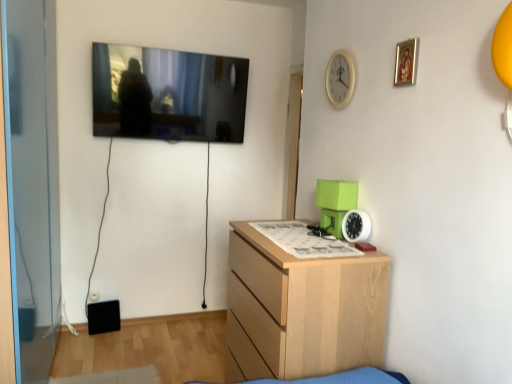
Question: Could gold-framed picture at upper right be considered to be inside flat screen tv at upper left?

Choices:
 (A) yes
 (B) no

Answer: (B)

Question: Considering the relative sizes of flat screen tv at upper left and gold-framed picture at upper right in the image provided, is flat screen tv at upper left thinner than gold-framed picture at upper right?

Choices:
 (A) yes
 (B) no

Answer: (B)

Question: Is flat screen tv at upper left outside of gold-framed picture at upper right?

Choices:
 (A) yes
 (B) no

Answer: (A)

Question: Are flat screen tv at upper left and gold-framed picture at upper right making contact?

Choices:
 (A) no
 (B) yes

Answer: (A)

Question: Does flat screen tv at upper left lie in front of gold-framed picture at upper right?

Choices:
 (A) yes
 (B) no

Answer: (B)

Question: From the image's perspective, is flat screen tv at upper left located above gold-framed picture at upper right?

Choices:
 (A) no
 (B) yes

Answer: (B)

Question: Is white plastic clock at right, the 1th clock from the bottom, positioned far away from flat screen tv at upper left?

Choices:
 (A) no
 (B) yes

Answer: (B)

Question: Is white plastic clock at right, the 1th clock from the bottom, aimed at flat screen tv at upper left?

Choices:
 (A) no
 (B) yes

Answer: (A)

Question: Does white plastic clock at right, arranged as the 2th clock when viewed from the top, appear on the right side of flat screen tv at upper left?

Choices:
 (A) no
 (B) yes

Answer: (B)

Question: Is white plastic clock at right, the 1th clock from the bottom, thinner than flat screen tv at upper left?

Choices:
 (A) yes
 (B) no

Answer: (A)

Question: Does white plastic clock at right, arranged as the 2th clock when viewed from the top, have a smaller size compared to flat screen tv at upper left?

Choices:
 (A) no
 (B) yes

Answer: (B)

Question: Is white plastic clock at right, the 1th clock from the bottom, wider than flat screen tv at upper left?

Choices:
 (A) no
 (B) yes

Answer: (A)

Question: Is white wooden clock at upper center, the 1th clock from the top, positioned far away from flat screen tv at upper left?

Choices:
 (A) yes
 (B) no

Answer: (A)